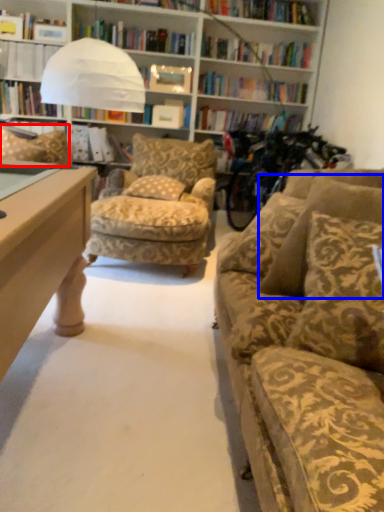
Question: Which point is further to the camera, pillow (highlighted by a red box) or pillow (highlighted by a blue box)?

Choices:
 (A) pillow
 (B) pillow

Answer: (A)